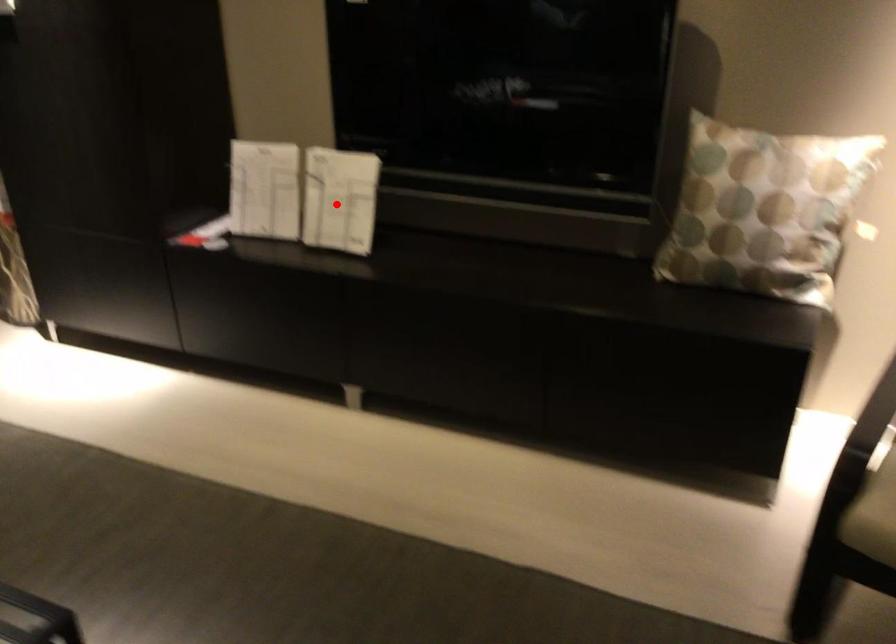
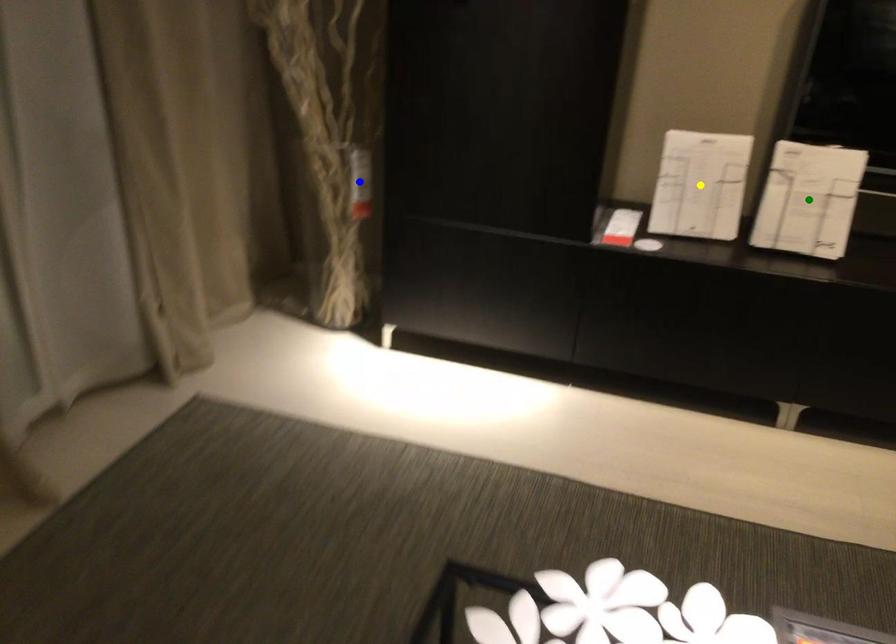
Question: I am providing you with two images of the same scene from different viewpoints. A red point is marked on the first image. You are given multiple points on the second image. Which mark in image 2 goes with the point in image 1?

Choices:
 (A) blue point
 (B) green point
 (C) yellow point

Answer: (B)